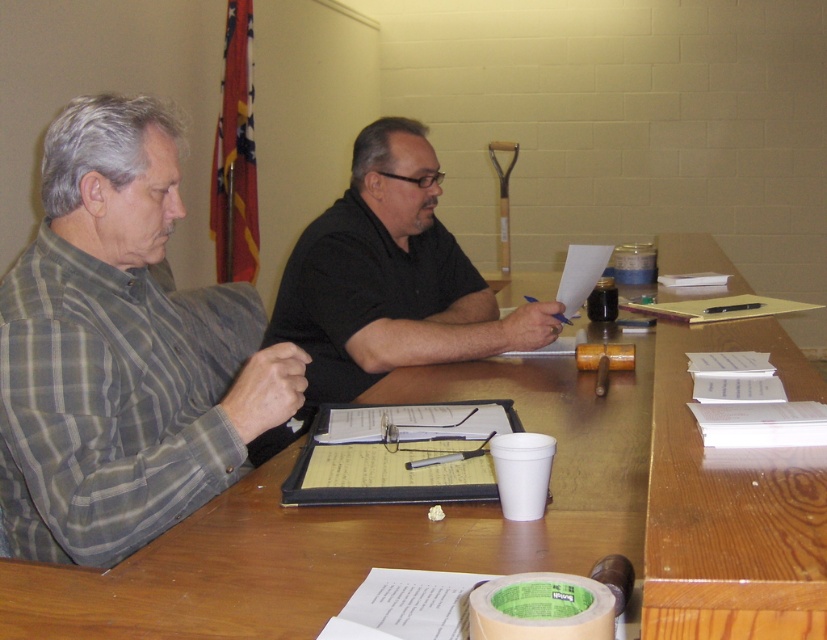
You are a delivery person standing at the entrance of the room. The point you need to reach is located at coordinates point (x=115, y=512). If you can move freely around the table, can you reach that point without passing between the two individuals?

The two individuals are 3.42 feet apart. Since the minimum distance between them is greater than the space needed for a person to pass through, you can reach the point (x=115, y=512) without needing to pass directly between them.

Based on the coordinates given, which object is located at point (122, 352)?

The point at (122, 352) indicates the plaid cotton shirt at left.

You are a service robot standing next to the plaid cotton shirt at left. Your task is to deliver a document to the black short sleeved shirt on the right. The document must be placed precisely on the table between the two individuals. The robot has a maximum reach of 1.0 meters. Can you reach the table between them from your current position?

The plaid cotton shirt at left and viewer are 1.02 meters apart from each other. Since the robot is next to the plaid cotton shirt at left, the distance to the table between them would be slightly more than 1.02 meters. The robot has a maximum reach of 1.0 meters, so it cannot reach the table between them.